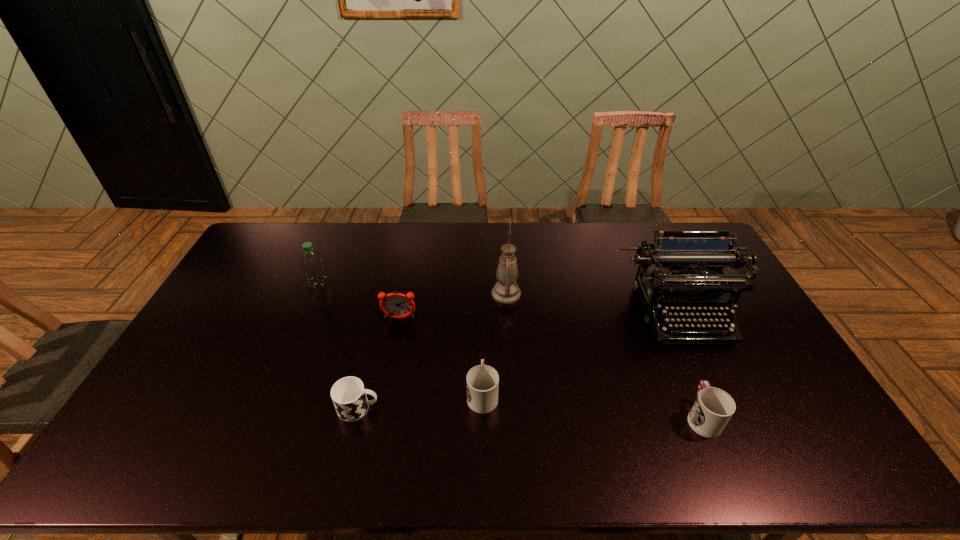
The height and width of the screenshot is (540, 960). I want to click on oil lamp, so click(x=506, y=290).

Locate an element on the screen. The width and height of the screenshot is (960, 540). typewriter is located at coordinates (688, 270).

You are a GUI agent. You are given a task and a screenshot of the screen. Output one action in this format:
    pyautogui.click(x=<x>, y=<y>)
    Task: Click on the fifth shortest object
    
    Given the screenshot: What is the action you would take?
    pyautogui.click(x=313, y=265)

Image resolution: width=960 pixels, height=540 pixels. Identify the location of water bottle. (313, 265).

Identify the location of the fourth shortest object. This screenshot has height=540, width=960. (396, 305).

This screenshot has height=540, width=960. In order to click on the second cup from left to right in this screenshot , I will do `click(482, 380)`.

Where is `the rightmost cup`? The height and width of the screenshot is (540, 960). the rightmost cup is located at coordinates (713, 408).

This screenshot has width=960, height=540. What are the coordinates of `the shortest object` in the screenshot? It's located at (349, 396).

Locate an element on the screen. the leftmost cup is located at coordinates (349, 396).

The image size is (960, 540). Identify the location of vacant space located on the back of the tallest object. (504, 256).